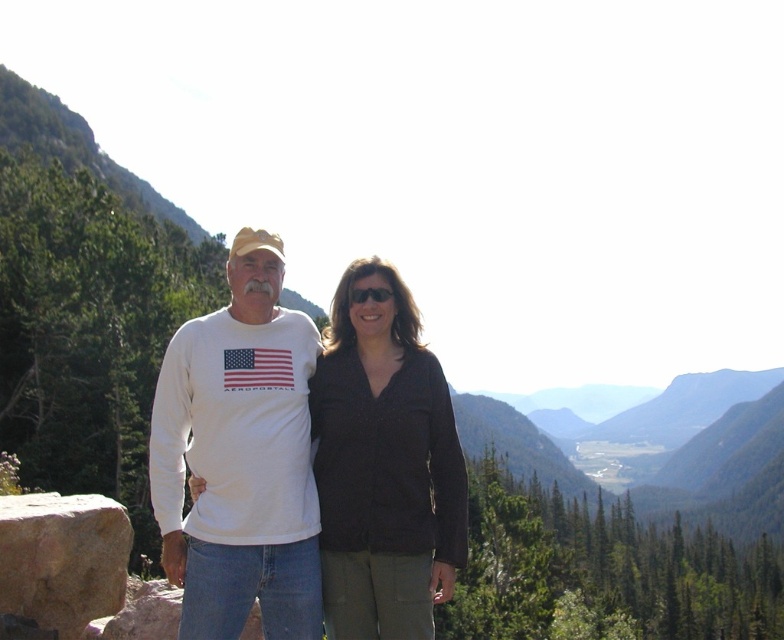
Question: Can you confirm if black matte shirt at center is positioned to the right of brown rough stone at lower left?

Choices:
 (A) no
 (B) yes

Answer: (B)

Question: Is white cotton t-shirt at left bigger than black matte shirt at center?

Choices:
 (A) no
 (B) yes

Answer: (B)

Question: Estimate the real-world distances between objects in this image. Which object is closer to the white cotton t-shirt at left?

Choices:
 (A) brown rough stone at lower left
 (B) black matte shirt at center

Answer: (B)

Question: Which of the following is the closest to the observer?

Choices:
 (A) brown rough stone at lower left
 (B) white cotton t-shirt at left

Answer: (B)

Question: Which object is the closest to the brown rough stone at lower left?

Choices:
 (A) white cotton t-shirt at left
 (B) black matte shirt at center

Answer: (A)

Question: Is the position of black matte shirt at center less distant than that of brown rough stone at lower left?

Choices:
 (A) yes
 (B) no

Answer: (A)